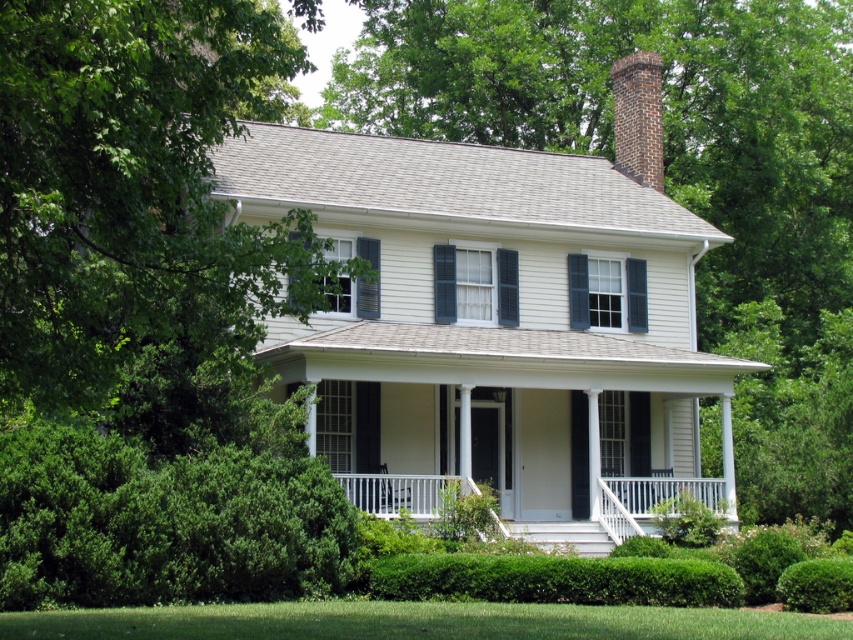
Who is more distant from viewer, (131, 115) or (352, 492)?

Point (352, 492)

Looking at this image, is green leafy tree at upper left wider than white painted wood porch at center?

No, green leafy tree at upper left is not wider than white painted wood porch at center.

Is point (35, 392) farther from camera compared to point (605, 481)?

No, (35, 392) is in front of (605, 481).

Identify the location of green leafy tree at upper left. (135, 188).

Is green leafy tree at center positioned before green leafy hedge at lower center?

No, green leafy tree at center is behind green leafy hedge at lower center.

Measure the distance from green leafy tree at center to green leafy hedge at lower center.

green leafy tree at center is 38.34 meters from green leafy hedge at lower center.

The image size is (853, 640). What are the coordinates of `green leafy tree at center` in the screenshot? It's located at (674, 173).

Identify the location of green leafy tree at center. (674, 173).

Is green matte shutter at center shorter than green matte shutter at lower left?

Yes, green matte shutter at center is shorter than green matte shutter at lower left.

Is green matte shutter at center further to the viewer compared to green matte shutter at lower left?

That is True.

Find the location of a particular element. green matte shutter at center is located at coordinates (461, 284).

Locate an element on the screen. green matte shutter at center is located at coordinates (461, 284).